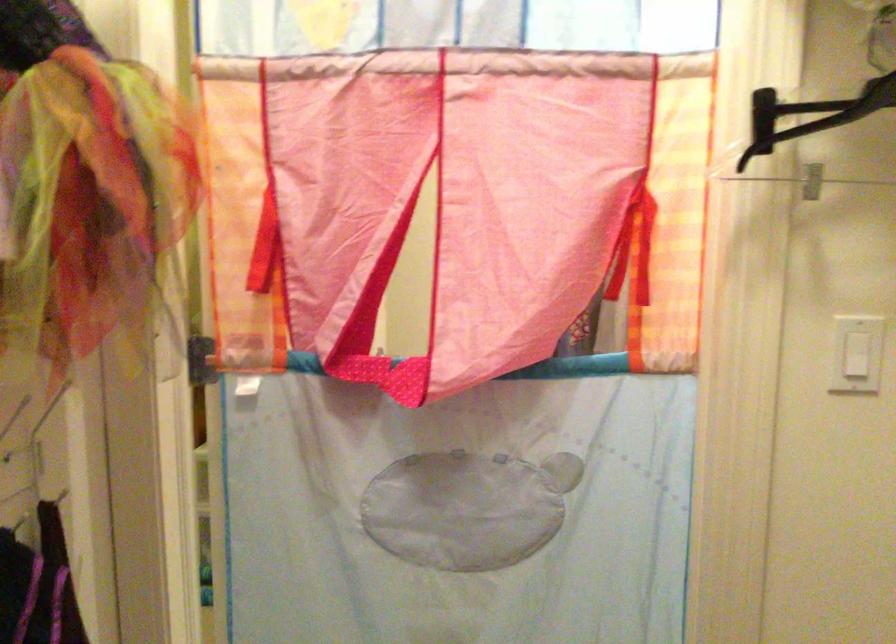
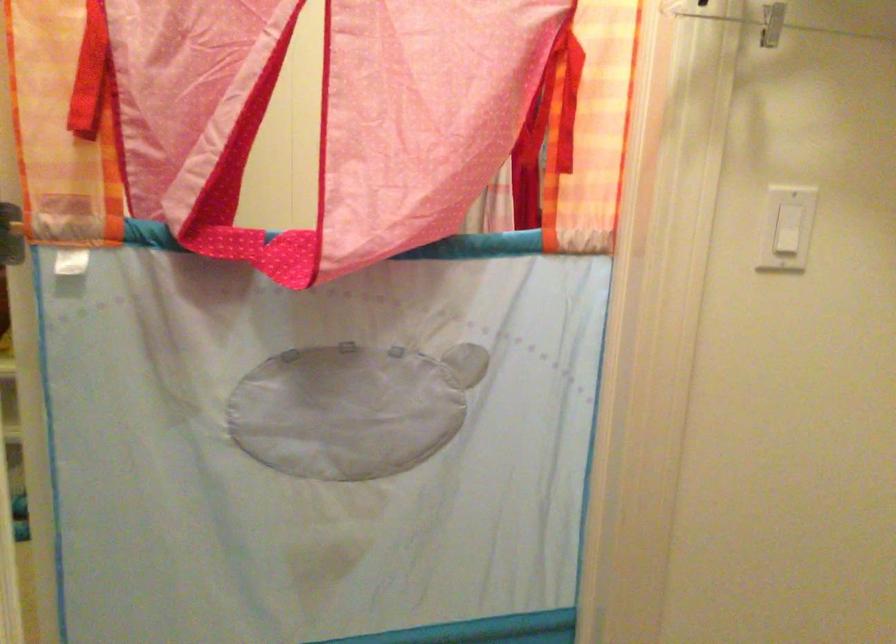
What movement of the cameraman would produce the second image?

The movement direction of the cameraman is left, forward.